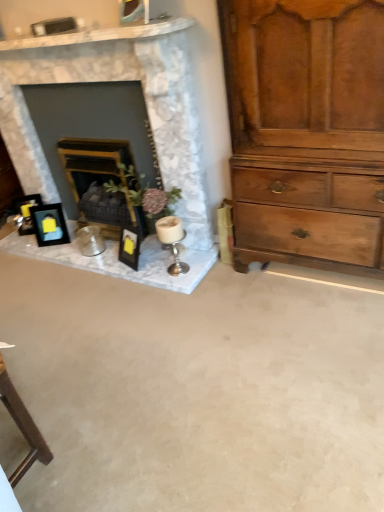
Question: From a real-world perspective, is matte black picture frame at left, which is the 2th picture frame in left-to-right order, above or below wooden mantelpiece at center, which is the second fireplace from left to right?

Choices:
 (A) below
 (B) above

Answer: (A)

Question: Does point (59, 220) appear closer or farther from the camera than point (89, 204)?

Choices:
 (A) farther
 (B) closer

Answer: (A)

Question: Which object is the closest to the matte black picture frame at left, the second picture frame positioned from the right?

Choices:
 (A) wooden mantelpiece at center, which is the second fireplace from left to right
 (B) silver metallic candle holder at center
 (C) white marble fireplace at upper left, acting as the second fireplace starting from the right
 (D) matte black picture frame at left, which is the 2th picture frame in left-to-right order
 (E) light brown wooden chest of drawers at right

Answer: (D)

Question: Which of these objects is positioned closest to the wooden mantelpiece at center, which is the second fireplace from left to right?

Choices:
 (A) matte black picture frame at left, which is the 1th picture frame in right-to-left order
 (B) matte black picture frame at left, the second picture frame positioned from the right
 (C) light brown wooden chest of drawers at right
 (D) white marble fireplace at upper left, acting as the second fireplace starting from the right
 (E) silver metallic candle holder at center

Answer: (D)